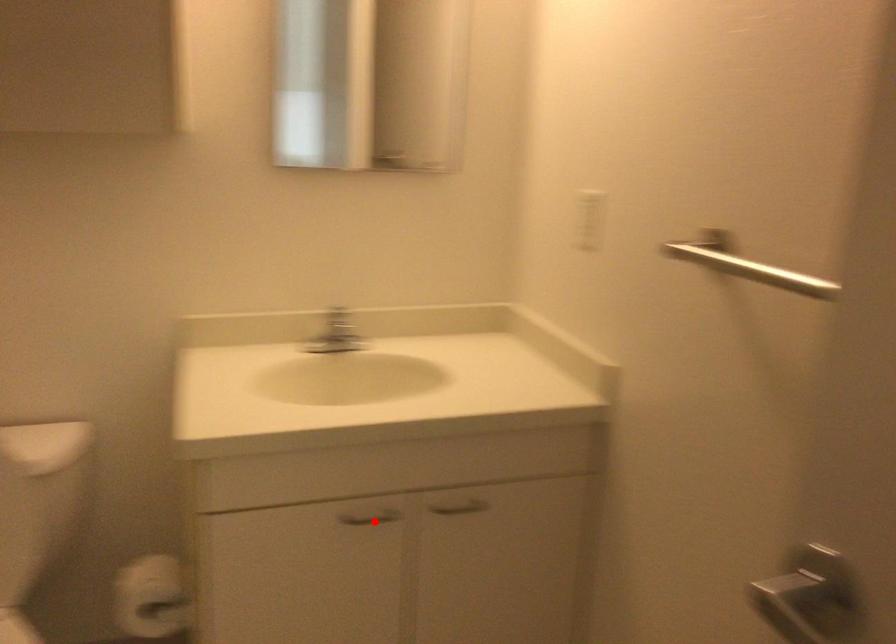
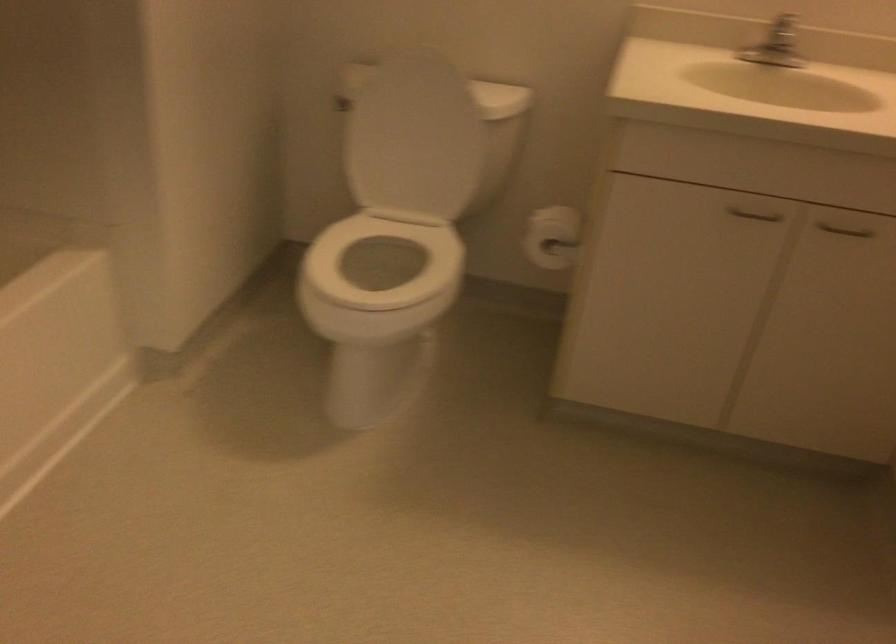
Find the pixel in the second image that matches the highlighted location in the first image.

(754, 214)